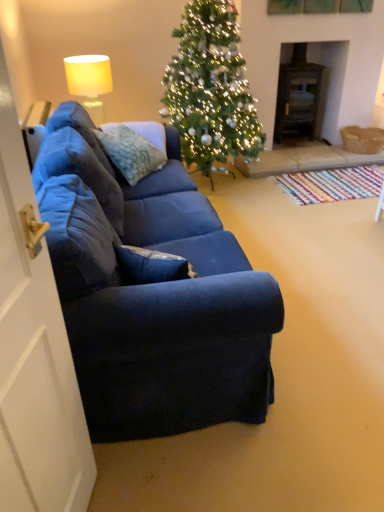
Question: Visually, is green matte christmas tree at center positioned to the left or to the right of white matte door at left?

Choices:
 (A) right
 (B) left

Answer: (A)

Question: Does point (253, 101) appear closer or farther from the camera than point (26, 331)?

Choices:
 (A) closer
 (B) farther

Answer: (B)

Question: Which of these objects is positioned closest to the matte yellow fabric lampshade at upper left?

Choices:
 (A) textured blue pillow at center
 (B) green matte christmas tree at center
 (C) dark wood fireplace at center right
 (D) white matte door at left

Answer: (A)

Question: Which of these objects is positioned farthest from the white matte door at left?

Choices:
 (A) dark wood fireplace at center right
 (B) textured blue pillow at center
 (C) matte yellow fabric lampshade at upper left
 (D) green matte christmas tree at center

Answer: (A)